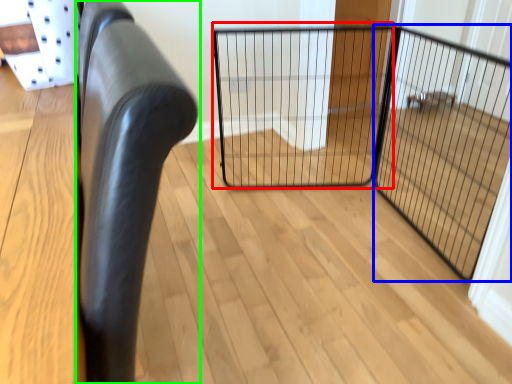
Question: Considering the real-world distances, which object is farthest from cage (highlighted by a red box)? screen door (highlighted by a blue box) or furniture (highlighted by a green box)?

Choices:
 (A) screen door
 (B) furniture

Answer: (B)